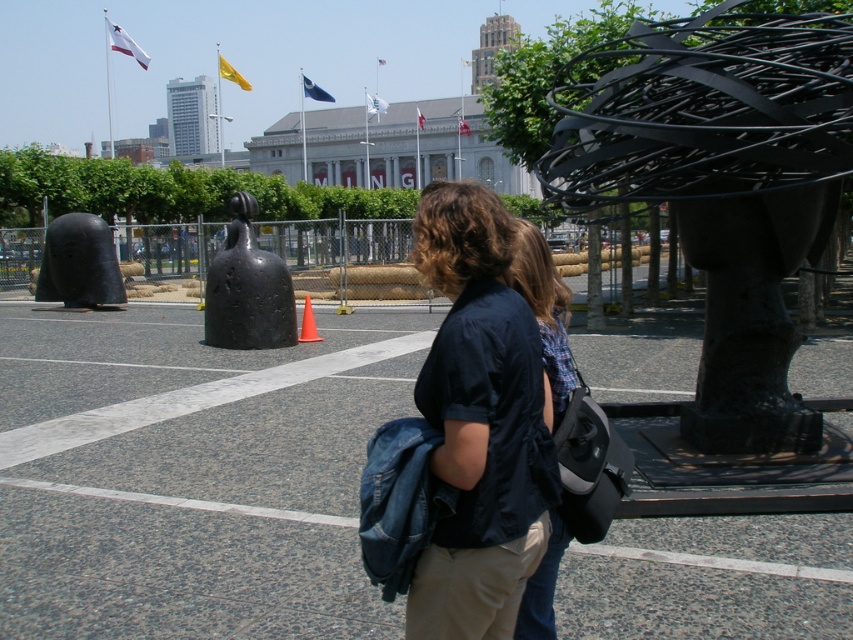
Does gray asphalt parking lot at center lie in front of black matte sculpture at left?

Yes, it is in front of black matte sculpture at left.

Does gray asphalt parking lot at center have a larger size compared to black matte sculpture at left?

Indeed, gray asphalt parking lot at center has a larger size compared to black matte sculpture at left.

This screenshot has height=640, width=853. What do you see at coordinates (192, 474) in the screenshot? I see `gray asphalt parking lot at center` at bounding box center [192, 474].

Identify the location of gray asphalt parking lot at center. (192, 474).

Who is lower down, black matte sculpture at center or orange matte cone at center?

orange matte cone at center

Does black matte sculpture at center appear on the left side of orange matte cone at center?

Yes, black matte sculpture at center is to the left of orange matte cone at center.

Does point (225, 320) come closer to viewer compared to point (308, 321)?

Yes, it is.

Where is `black matte sculpture at center`? This screenshot has width=853, height=640. black matte sculpture at center is located at coordinates (247, 289).

Does black matte sculpture at center appear on the left side of black matte sculpture at left?

No, black matte sculpture at center is not to the left of black matte sculpture at left.

Is point (283, 321) positioned before point (114, 253)?

Yes, point (283, 321) is in front of point (114, 253).

You are a GUI agent. You are given a task and a screenshot of the screen. Output one action in this format:
    pyautogui.click(x=<x>, y=<y>)
    Task: Click on the black matte sculpture at center
    This screenshot has width=853, height=640.
    Given the screenshot: What is the action you would take?
    pyautogui.click(x=247, y=289)